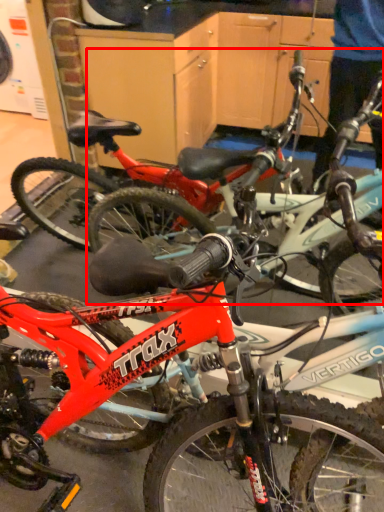
Question: Considering the relative positions of bicycle (annotated by the red box) and bicycle in the image provided, where is bicycle (annotated by the red box) located with respect to the staircase?

Choices:
 (A) right
 (B) left

Answer: (B)